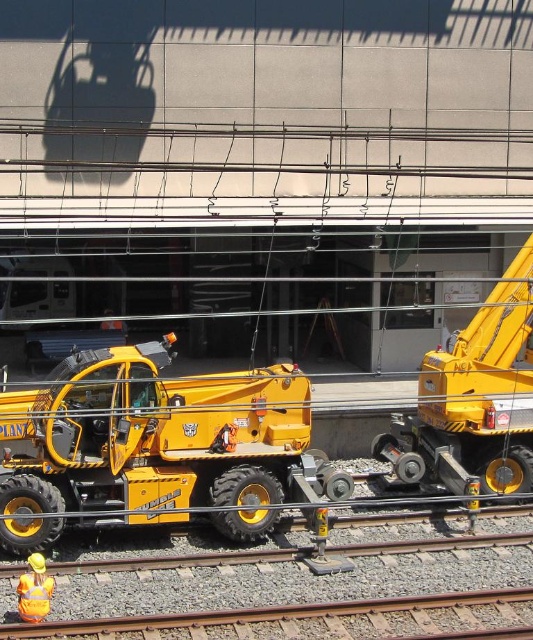
You are a construction worker standing at the camera position. You need to move a heavy load from the yellow rubber truck at center to the yellow telescopic handler in the foreground. The telescopic handler has a maximum reach of 10 meters. Can the telescopic handler safely lift the load from the truck without needing to move either vehicle?

The yellow rubber truck at center is 11.32 meters from the camera. Since the telescopic handler has a maximum reach of 10 meters, it cannot safely lift the load from the truck without moving either vehicle because the distance exceeds its reach capability.